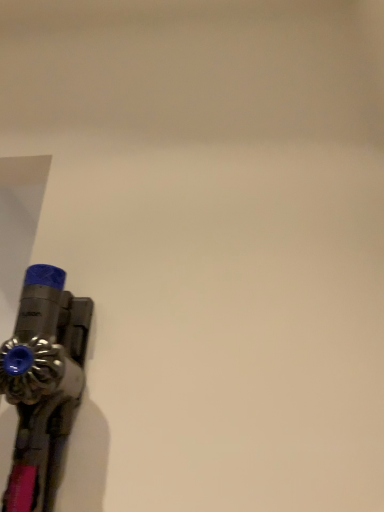
Describe the element at coordinates (43, 384) in the screenshot. The image size is (384, 512). I see `metallic gray vacuum cleaner at left` at that location.

I want to click on metallic gray vacuum cleaner at left, so click(43, 384).

The image size is (384, 512). Find the location of `metallic gray vacuum cleaner at left`. metallic gray vacuum cleaner at left is located at coordinates (43, 384).